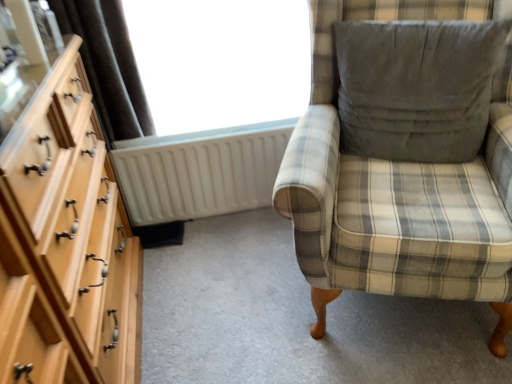
Question: Considering their positions, is transparent glass window at upper center located in front of or behind gray suede pillow at upper right?

Choices:
 (A) behind
 (B) front

Answer: (A)

Question: Is transparent glass window at upper center to the left or to the right of gray suede pillow at upper right in the image?

Choices:
 (A) left
 (B) right

Answer: (A)

Question: Which object is the closest to the transparent glass window at upper center?

Choices:
 (A) white plastic radiator at center
 (B) gray suede pillow at upper right
 (C) plaid fabric armchair at right
 (D) light wood dresser at left

Answer: (A)

Question: Estimate the real-world distances between objects in this image. Which object is farther from the plaid fabric armchair at right?

Choices:
 (A) gray suede pillow at upper right
 (B) white plastic radiator at center
 (C) light wood dresser at left
 (D) transparent glass window at upper center

Answer: (C)